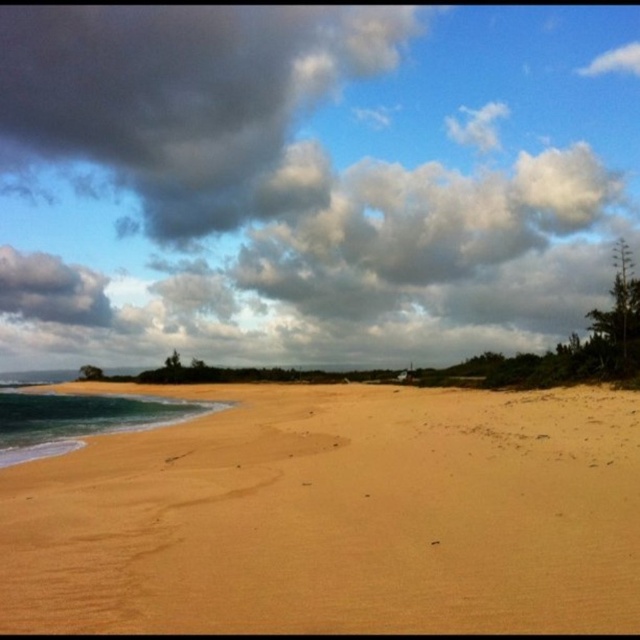
Question: Estimate the real-world distances between objects in this image. Which object is closer to the blue glossy water at lower left?

Choices:
 (A) dark gray cloud at upper left
 (B) sandy yellow beach at lower left

Answer: (B)

Question: Which of these objects is positioned closest to the dark gray cloud at upper left?

Choices:
 (A) blue glossy water at lower left
 (B) sandy yellow beach at lower left

Answer: (A)

Question: Among these points, which one is nearest to the camera?

Choices:
 (A) (35, 456)
 (B) (74, 150)

Answer: (A)

Question: Is dark gray cloud at upper left thinner than blue glossy water at lower left?

Choices:
 (A) yes
 (B) no

Answer: (B)

Question: Is sandy yellow beach at lower left closer to the viewer compared to blue glossy water at lower left?

Choices:
 (A) no
 (B) yes

Answer: (B)

Question: From the image, what is the correct spatial relationship of dark gray cloud at upper left in relation to blue glossy water at lower left?

Choices:
 (A) right
 (B) left

Answer: (B)